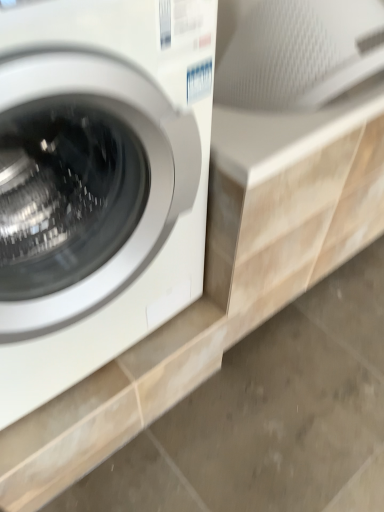
Where is `white glossy washing machine at left`? The width and height of the screenshot is (384, 512). white glossy washing machine at left is located at coordinates (98, 182).

What do you see at coordinates (98, 182) in the screenshot? I see `white glossy washing machine at left` at bounding box center [98, 182].

At what (x,y) coordinates should I click in order to perform the action: click on white glossy washing machine at left. Please return your answer as a coordinate pair (x, y). This screenshot has width=384, height=512. Looking at the image, I should click on (98, 182).